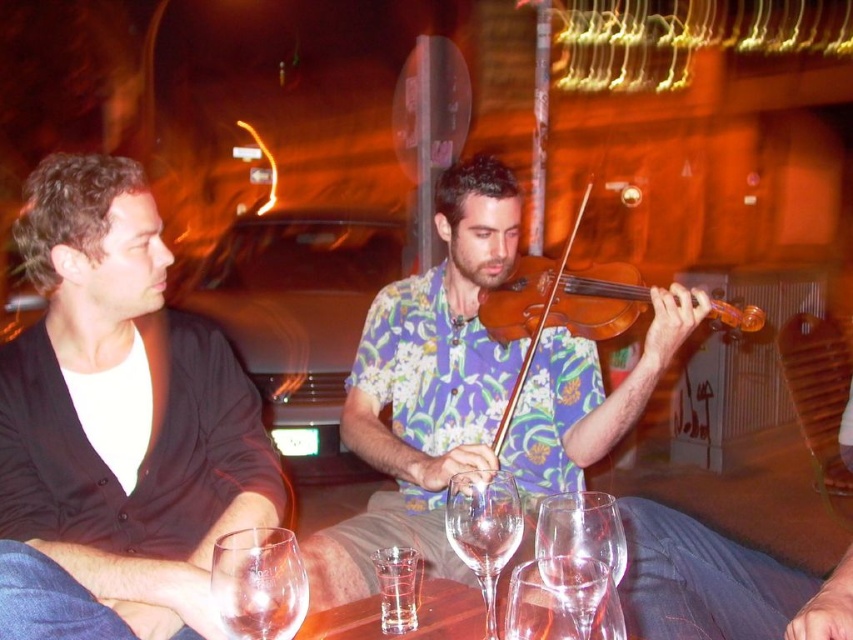
You are a bartender preparing a drink and notice the black matte shirt at left and the transparent glass wine glass at lower center. Which object is taller?

The black matte shirt at left is taller than the transparent glass wine glass at lower center.